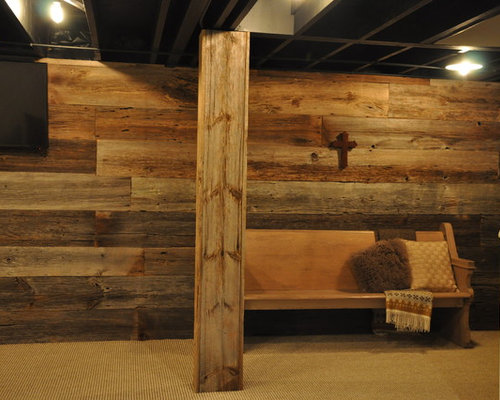
In order to click on joist in this screenshot , I will do `click(21, 32)`, `click(92, 32)`, `click(159, 29)`, `click(186, 28)`, `click(219, 21)`, `click(238, 21)`, `click(330, 6)`, `click(382, 23)`, `click(449, 31)`, `click(458, 51)`.